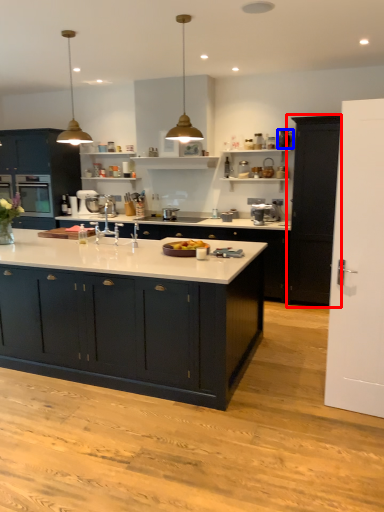
Question: Which point is closer to the camera, cabinetry (highlighted by a red box) or appliance (highlighted by a blue box)?

Choices:
 (A) cabinetry
 (B) appliance

Answer: (A)